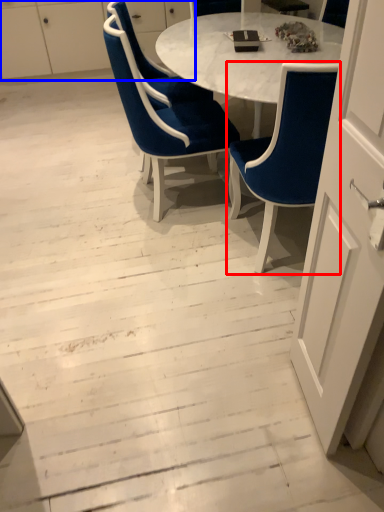
Question: Which object appears farthest to the camera in this image, chair (highlighted by a red box) or dresser (highlighted by a blue box)?

Choices:
 (A) chair
 (B) dresser

Answer: (B)